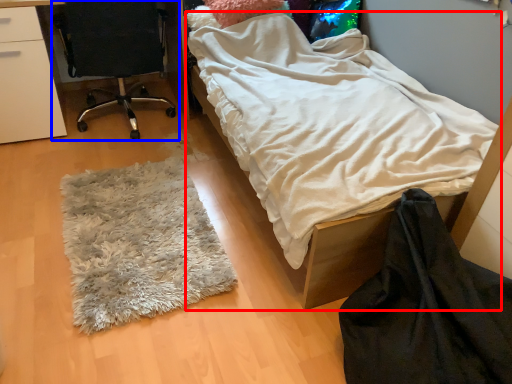
Question: Among these objects, which one is farthest to the camera, bed (highlighted by a red box) or chair (highlighted by a blue box)?

Choices:
 (A) bed
 (B) chair

Answer: (B)